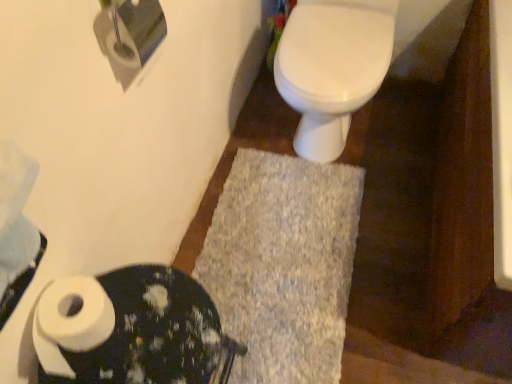
Find the location of `free location above white matte toilet paper at lower left (from a real-world perspective)`. free location above white matte toilet paper at lower left (from a real-world perspective) is located at coordinates click(142, 331).